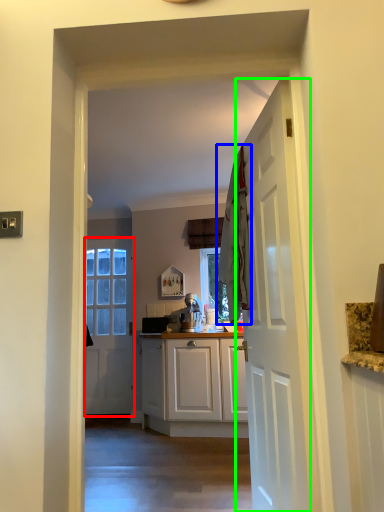
Question: Estimate the real-world distances between objects in this image. Which object is farther from door (highlighted by a red box), laundry (highlighted by a blue box) or door (highlighted by a green box)?

Choices:
 (A) laundry
 (B) door

Answer: (B)